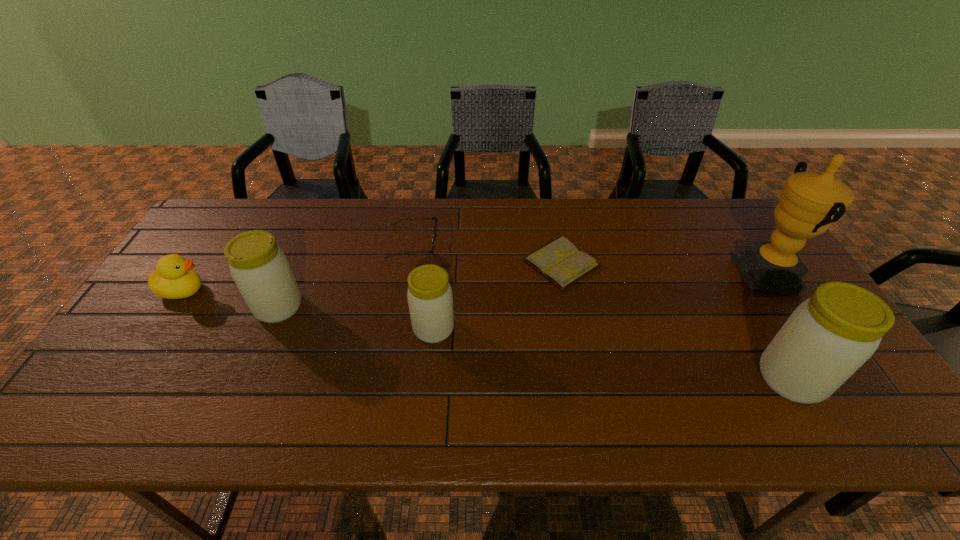
Where is `vacant space in between the second jar from right to left and the second tallest jar`? The image size is (960, 540). vacant space in between the second jar from right to left and the second tallest jar is located at coordinates (356, 318).

You are a GUI agent. You are given a task and a screenshot of the screen. Output one action in this format:
    pyautogui.click(x=<x>, y=<y>)
    Task: Click on the second closest object to the shortest jar
    This screenshot has width=960, height=540.
    Given the screenshot: What is the action you would take?
    pyautogui.click(x=435, y=226)

Find the location of a particular element. This screenshot has width=960, height=540. object that is the fourth closest to the leftmost object is located at coordinates pyautogui.click(x=560, y=262).

Point out which jar is positioned as the nearest to the third tallest object. Please provide its 2D coordinates. Your answer should be formatted as a tuple, i.e. [(x, y)], where the tuple contains the x and y coordinates of a point satisfying the conditions above.

[(430, 299)]

Locate which jar is the second closest to the leftmost object. Please provide its 2D coordinates. Your answer should be formatted as a tuple, i.e. [(x, y)], where the tuple contains the x and y coordinates of a point satisfying the conditions above.

[(430, 299)]

Where is `blank space that satisfies the following two spatial constraints: 1. at the beak of the duck; 2. on the right side of the second jar from right to left`? This screenshot has height=540, width=960. blank space that satisfies the following two spatial constraints: 1. at the beak of the duck; 2. on the right side of the second jar from right to left is located at coordinates point(157,329).

Where is `vacant region that satisfies the following two spatial constraints: 1. on the front-facing side of the sixth tallest object; 2. on the left side of the diary`? Image resolution: width=960 pixels, height=540 pixels. vacant region that satisfies the following two spatial constraints: 1. on the front-facing side of the sixth tallest object; 2. on the left side of the diary is located at coordinates (408, 263).

Find the location of a particular element. The width and height of the screenshot is (960, 540). free space in the image that satisfies the following two spatial constraints: 1. on the back side of the diary; 2. on the right side of the third tallest object is located at coordinates (298, 263).

The image size is (960, 540). Find the location of `blank area in the image that satisfies the following two spatial constraints: 1. at the beak of the leftmost object; 2. on the right side of the sixth object from right to left`. blank area in the image that satisfies the following two spatial constraints: 1. at the beak of the leftmost object; 2. on the right side of the sixth object from right to left is located at coordinates (172, 307).

This screenshot has height=540, width=960. What are the coordinates of `vacant space that satisfies the following two spatial constraints: 1. at the front of the award with handles; 2. on the front side of the rightmost jar` in the screenshot? It's located at click(834, 379).